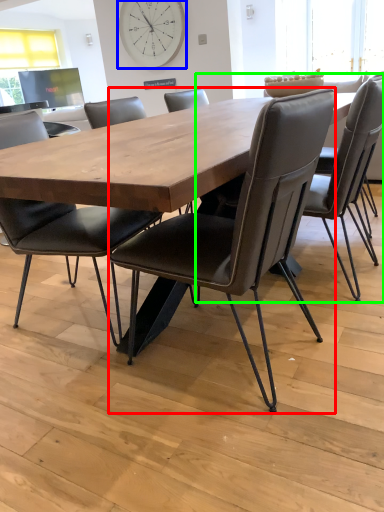
Question: Based on their relative distances, which object is nearer to chair (highlighted by a red box)? Choose from clock (highlighted by a blue box) and chair (highlighted by a green box).

Choices:
 (A) clock
 (B) chair

Answer: (B)